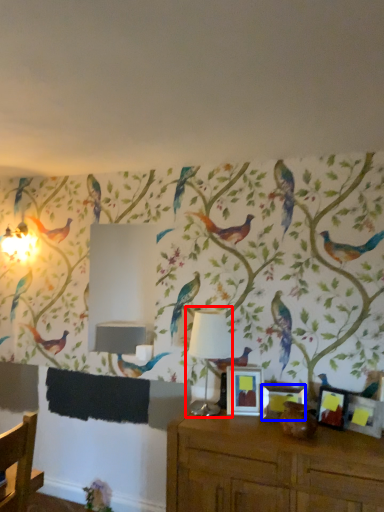
Question: Which point is closer to the camera, table lamp (highlighted by a red box) or picture frame (highlighted by a blue box)?

Choices:
 (A) table lamp
 (B) picture frame

Answer: (B)